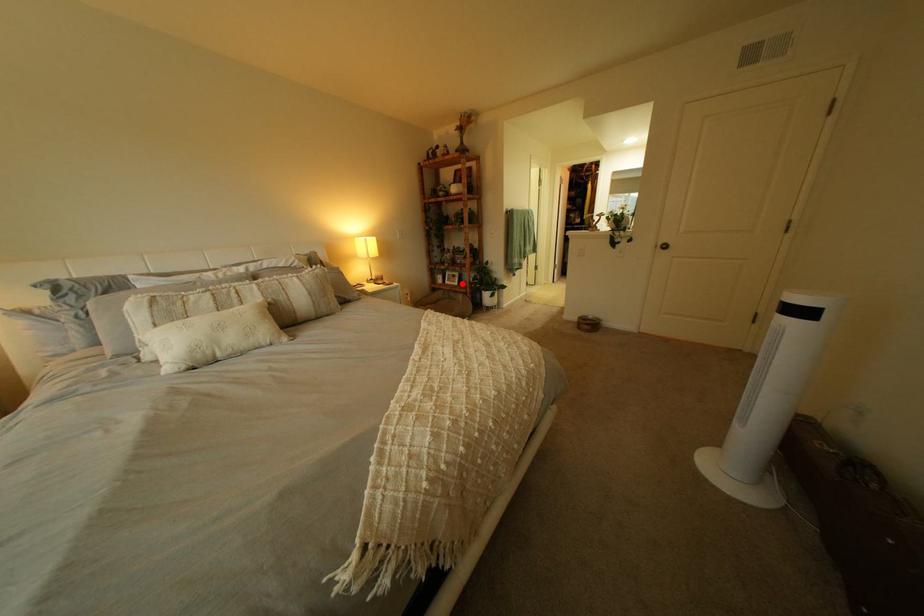
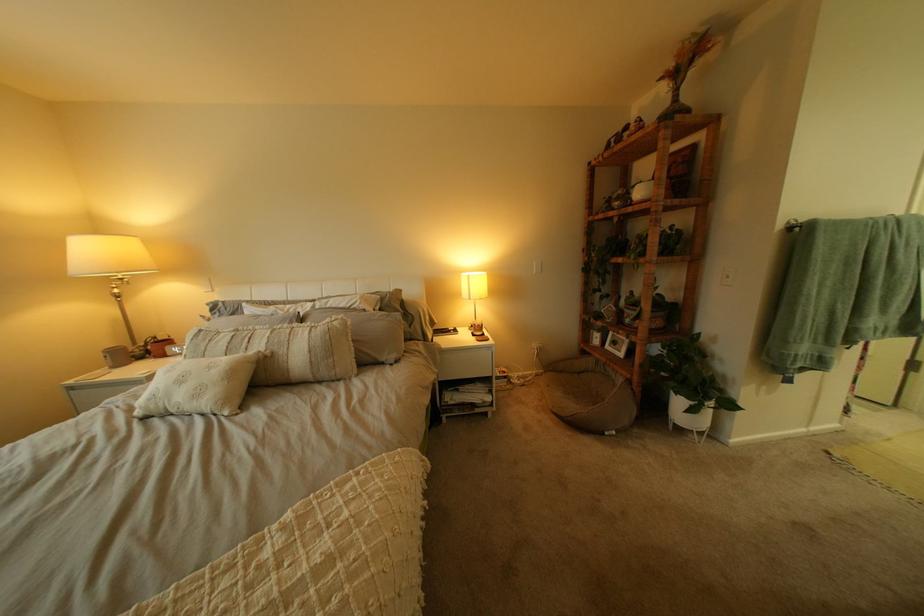
Question: I am providing you with two images of the same scene from different viewpoints. Given a red point in image1, look at the same physical point in image2. Is it:

Choices:
 (A) Closer to the viewpoint
 (B) Farther from the viewpoint

Answer: (B)